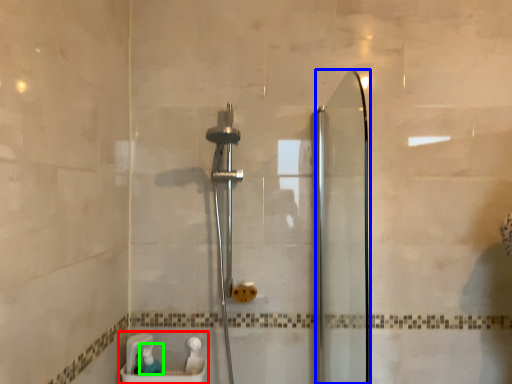
Question: Which object is positioned closest to sink (highlighted by a red box)? Select from screen door (highlighted by a blue box) and toiletry (highlighted by a green box).

Choices:
 (A) screen door
 (B) toiletry

Answer: (B)